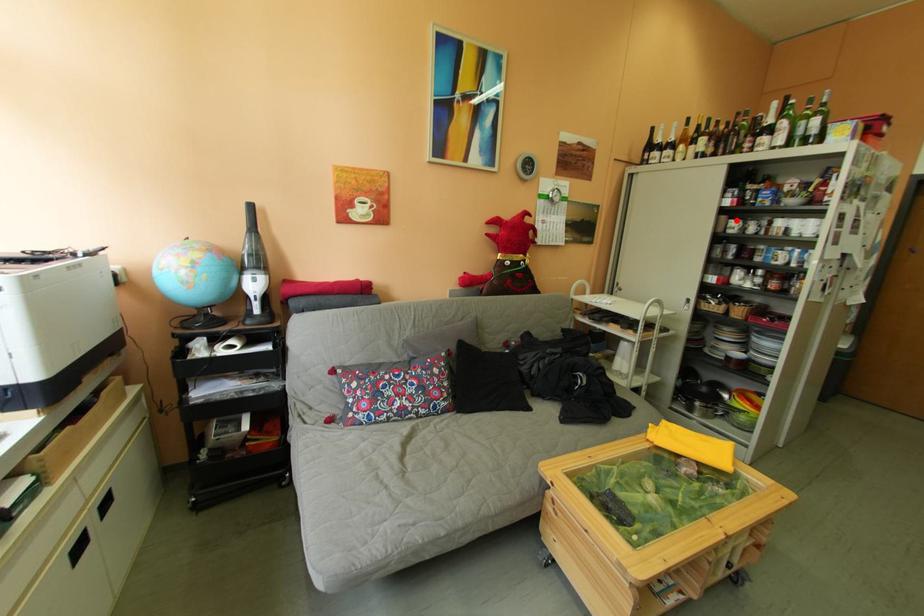
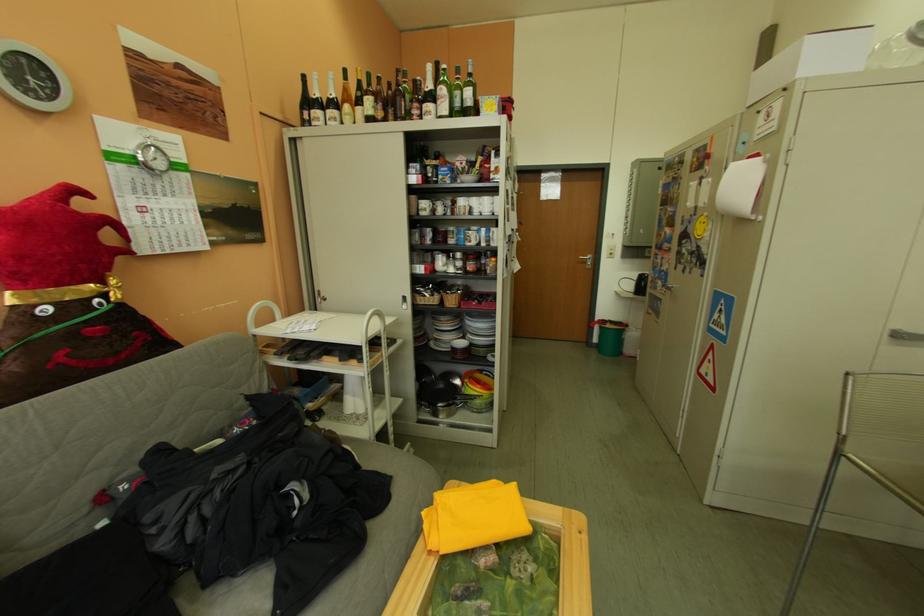
Find the pixel in the second image that matches the highlighted location in the first image.

(427, 201)